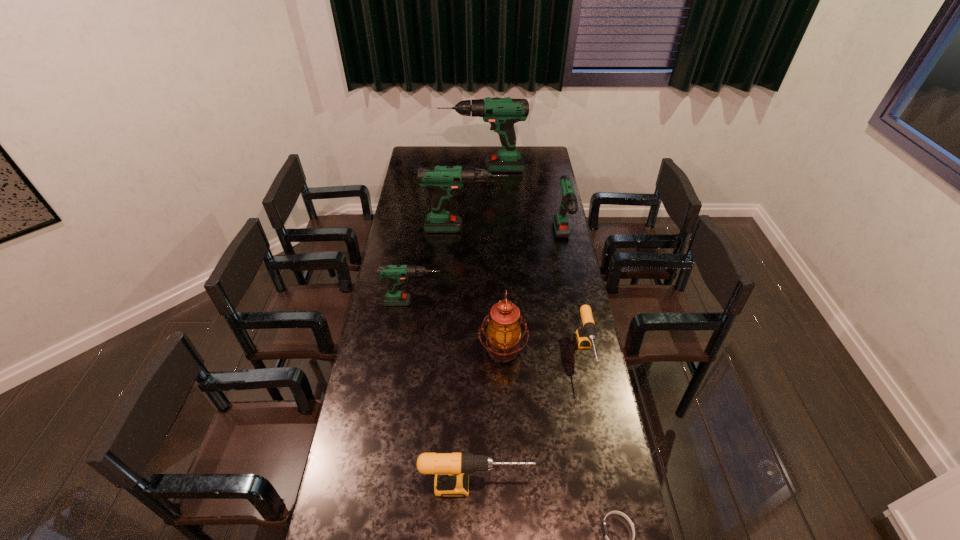
The image size is (960, 540). Find the location of `the farthest green drill`. the farthest green drill is located at coordinates (502, 113).

Locate an element on the screen. Image resolution: width=960 pixels, height=540 pixels. the farthest drill is located at coordinates point(502,113).

Identify the location of the third smallest green drill. The height and width of the screenshot is (540, 960). (444, 180).

You are a GUI agent. You are given a task and a screenshot of the screen. Output one action in this format:
    pyautogui.click(x=<x>, y=<y>)
    Task: Click on the oil lamp
    Image resolution: width=960 pixels, height=540 pixels.
    Given the screenshot: What is the action you would take?
    pyautogui.click(x=503, y=333)

Image resolution: width=960 pixels, height=540 pixels. In order to click on the third biggest green drill in this screenshot , I will do tap(569, 204).

Find the location of a particular element. the fourth shortest drill is located at coordinates (569, 204).

Image resolution: width=960 pixels, height=540 pixels. I want to click on the fifth nearest object, so click(396, 274).

Where is `the third nearest drill`? Image resolution: width=960 pixels, height=540 pixels. the third nearest drill is located at coordinates (396, 274).

Identify the location of the nearest drill. The width and height of the screenshot is (960, 540). (452, 470).

The width and height of the screenshot is (960, 540). I want to click on the bigger black drill, so click(452, 470).